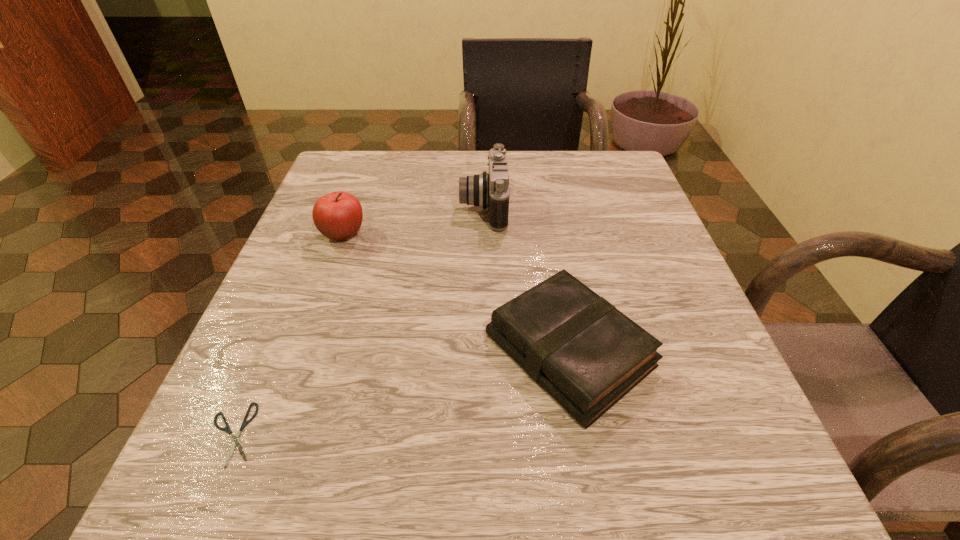
You are a GUI agent. You are given a task and a screenshot of the screen. Output one action in this format:
    pyautogui.click(x=<x>, y=<y>)
    Task: Click on the vacant space at the far left corner of the desktop
    This screenshot has width=960, height=540.
    Given the screenshot: What is the action you would take?
    pyautogui.click(x=358, y=181)

In the image, there is a desktop. Where is `blank space at the near left corner`? This screenshot has width=960, height=540. blank space at the near left corner is located at coordinates (311, 454).

The image size is (960, 540). I want to click on vacant space at the far right corner, so click(596, 194).

At what (x,y) coordinates should I click in order to perform the action: click on free space at the near right corner of the desktop. Please return your answer as a coordinate pair (x, y). Image resolution: width=960 pixels, height=540 pixels. Looking at the image, I should click on (657, 452).

Where is `free spot between the second tallest object and the shortest object`? Image resolution: width=960 pixels, height=540 pixels. free spot between the second tallest object and the shortest object is located at coordinates (288, 334).

Where is `free space between the book and the tallest object`? This screenshot has height=540, width=960. free space between the book and the tallest object is located at coordinates (526, 279).

This screenshot has width=960, height=540. In order to click on vacant area between the shortest object and the apple in this screenshot , I will do `click(288, 334)`.

I want to click on free space that is in between the tallest object and the third shortest object, so click(x=414, y=220).

Locate an element on the screen. vacant region between the camera and the book is located at coordinates (526, 279).

Locate an element on the screen. The width and height of the screenshot is (960, 540). free space between the book and the apple is located at coordinates (456, 292).